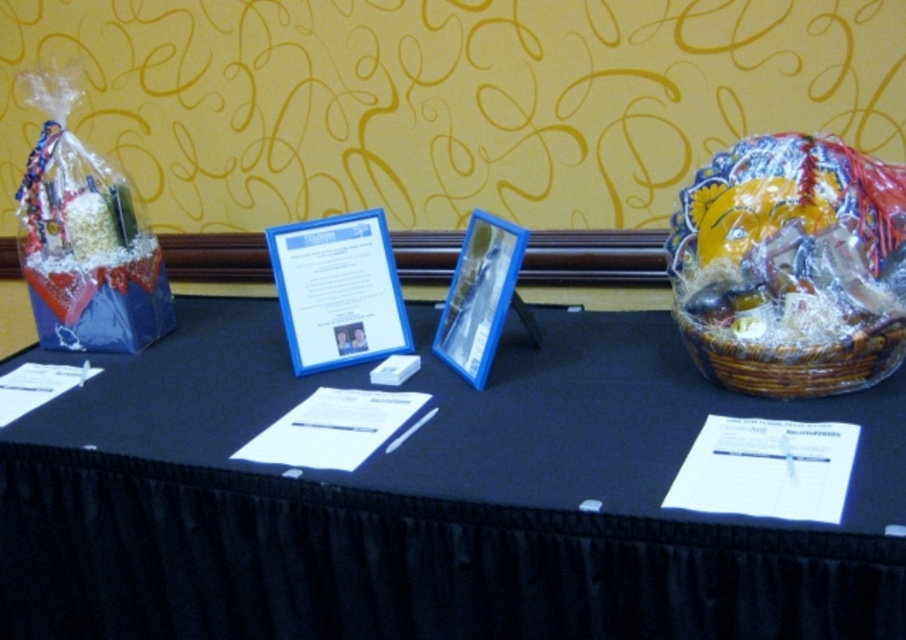
You are at a raffle event and want to grab the woven brown basket at right. To reach it, you need to move past the clear plastic frame at center. Based on their positions, which direction should you move from the frame to get to the basket?

The clear plastic frame at center is to the left of the woven brown basket at right, so you should move to the right from the frame to reach the basket.

You are an event organizer standing at the back of the room. You need to move the black fabric table at center closer to the entrance, which is located to the right of the woven brown basket at right. Is the table currently positioned to the left or right of the basket?

The black fabric table at center is to the left of woven brown basket at right, so it is positioned to the left of the basket.

You are organizing an event and need to place a decorative item between the clear plastic frame at center and the woven brown basket at right. What is the minimum distance you should leave between them to ensure the item fits?

The clear plastic frame at center and woven brown basket at right are 27.83 inches apart, so the decorative item must be placed within this distance. The minimum distance between them should be less than or equal to 27.83 inches to fit.